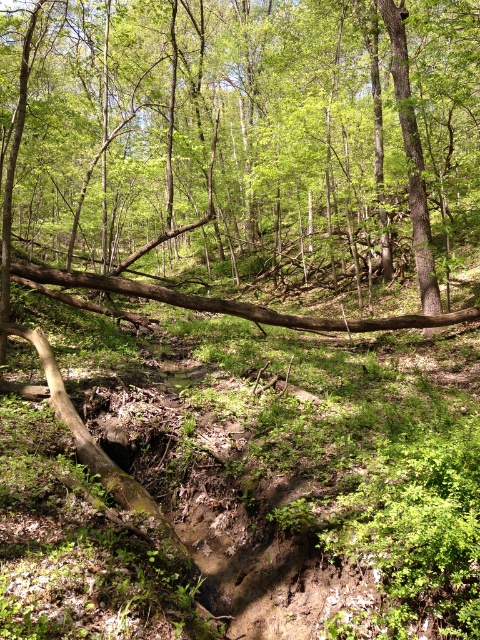
Question: Where is brown rough log at center located in relation to brown rough tree trunk at upper center in the image?

Choices:
 (A) right
 (B) left

Answer: (B)

Question: Which point is closer to the camera?

Choices:
 (A) brown rough log at center
 (B) brown rough tree trunk at upper center

Answer: (A)

Question: Among these objects, which one is nearest to the camera?

Choices:
 (A) brown rough tree trunk at upper center
 (B) brown rough log at center

Answer: (B)

Question: Can you confirm if brown rough log at center is smaller than brown rough tree trunk at upper center?

Choices:
 (A) yes
 (B) no

Answer: (B)

Question: Which object is farther from the camera taking this photo?

Choices:
 (A) brown rough log at center
 (B) brown rough tree trunk at upper center

Answer: (B)

Question: Is brown rough log at center closer to the viewer compared to brown rough tree trunk at upper center?

Choices:
 (A) no
 (B) yes

Answer: (B)